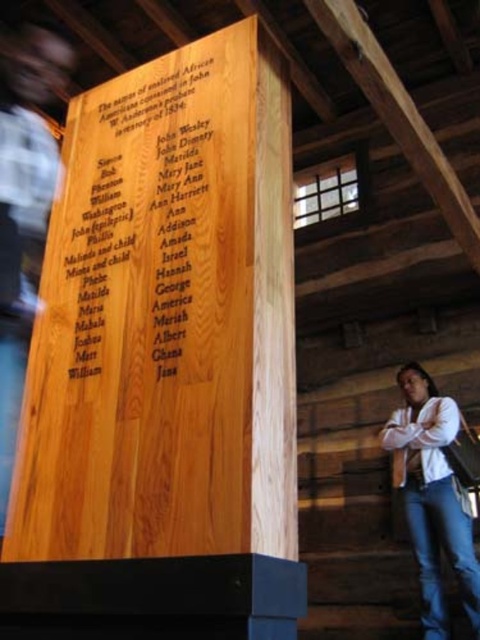
Question: Can you confirm if wooden plaque at center is positioned to the left of white shirt at lower right?

Choices:
 (A) no
 (B) yes

Answer: (B)

Question: Can you confirm if light brown wood man at left is positioned to the left of white shirt at lower right?

Choices:
 (A) yes
 (B) no

Answer: (A)

Question: Estimate the real-world distances between objects in this image. Which object is farther from the light brown wood man at left?

Choices:
 (A) wooden plaque at center
 (B) white shirt at lower right

Answer: (B)

Question: Among these points, which one is farthest from the camera?

Choices:
 (A) (131, 109)
 (B) (10, 64)

Answer: (B)

Question: Which point is farther to the camera?

Choices:
 (A) white shirt at lower right
 (B) wooden plaque at center
 (C) light brown wood man at left

Answer: (A)

Question: Can you confirm if light brown wood man at left is positioned below white shirt at lower right?

Choices:
 (A) no
 (B) yes

Answer: (A)